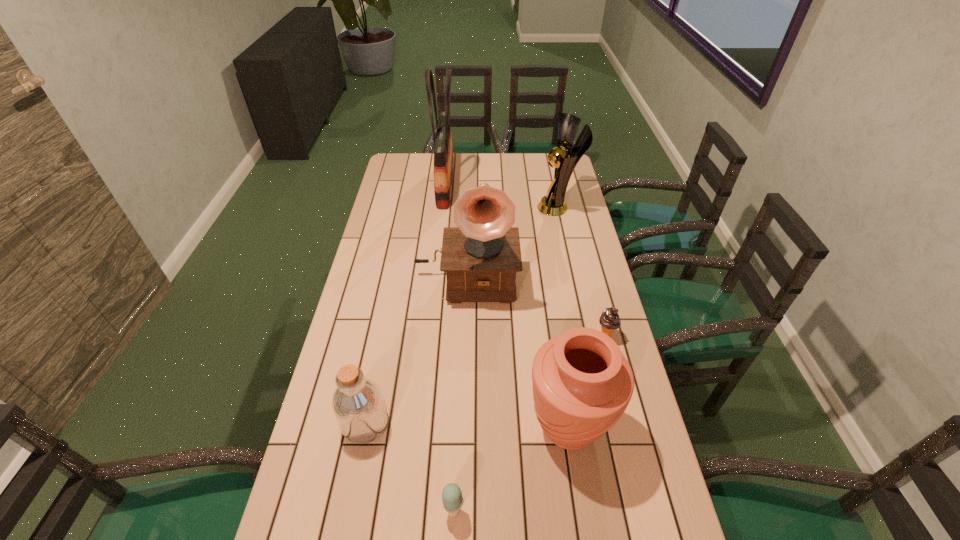
This screenshot has width=960, height=540. I want to click on shopping bag, so click(x=443, y=151).

Image resolution: width=960 pixels, height=540 pixels. What are the coordinates of `record player` in the screenshot? It's located at (481, 256).

Image resolution: width=960 pixels, height=540 pixels. Identify the location of award. (553, 204).

Image resolution: width=960 pixels, height=540 pixels. Find the location of `vase`. vase is located at coordinates pyautogui.click(x=582, y=384).

The height and width of the screenshot is (540, 960). I want to click on bottle, so click(x=358, y=405).

The height and width of the screenshot is (540, 960). In order to click on the leftmost object in this screenshot , I will do `click(358, 405)`.

Locate an element on the screen. The height and width of the screenshot is (540, 960). the right ice cream is located at coordinates (609, 320).

Where is `the farther ice cream`? the farther ice cream is located at coordinates (609, 320).

Locate an element on the screen. Image resolution: width=960 pixels, height=540 pixels. the left ice cream is located at coordinates (452, 499).

The width and height of the screenshot is (960, 540). I want to click on the nearer ice cream, so click(x=452, y=499).